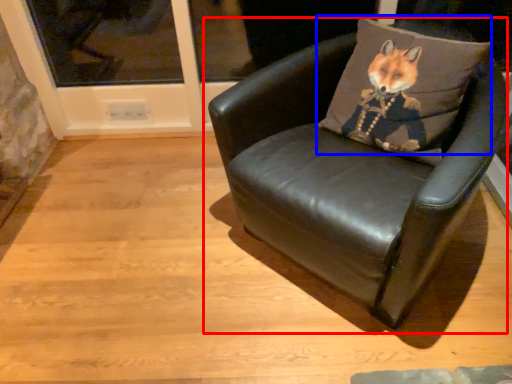
Question: Which point is closer to the camera, chair (highlighted by a red box) or throw pillow (highlighted by a blue box)?

Choices:
 (A) chair
 (B) throw pillow

Answer: (A)